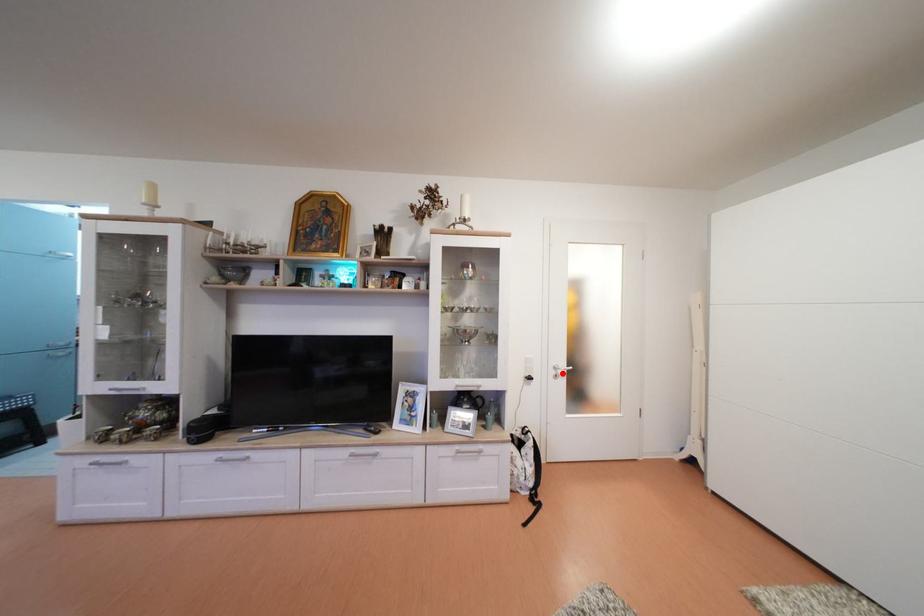
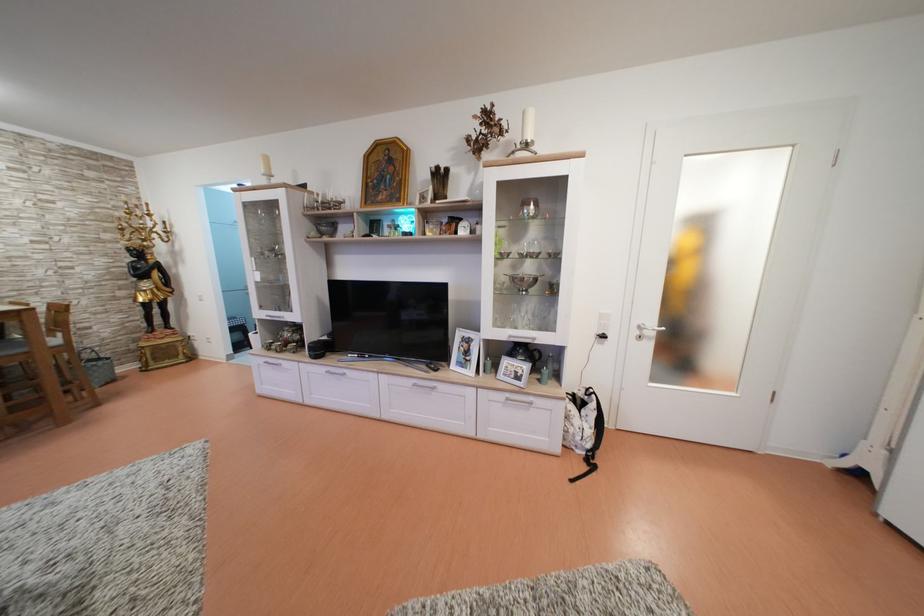
In the second image, find the point that corresponds to the highlighted location in the first image.

(647, 333)